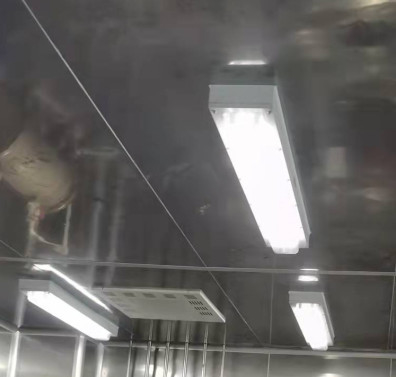
Locate an element on the screen. horizontal fixtures is located at coordinates (84, 323), (315, 316), (280, 228).